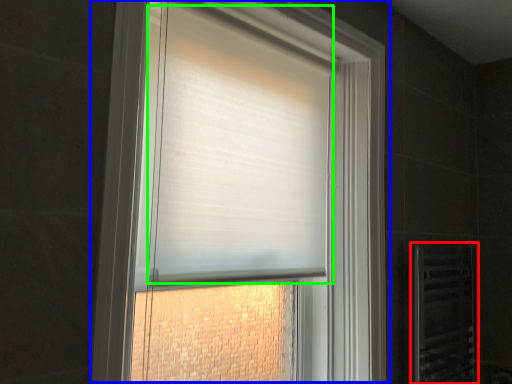
Question: Estimate the real-world distances between objects in this image. Which object is closer to screen door (highlighted by a red box), window (highlighted by a blue box) or blind (highlighted by a green box)?

Choices:
 (A) window
 (B) blind

Answer: (A)